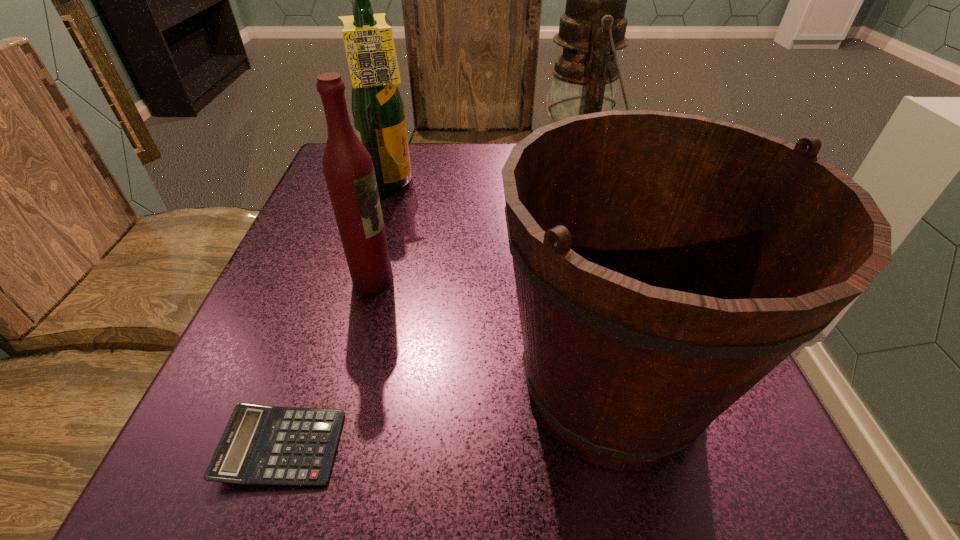
Image resolution: width=960 pixels, height=540 pixels. Identify the location of free location that satisfies the following two spatial constraints: 1. on the label of the nearer liquor; 2. on the left side of the bucket. (348, 379).